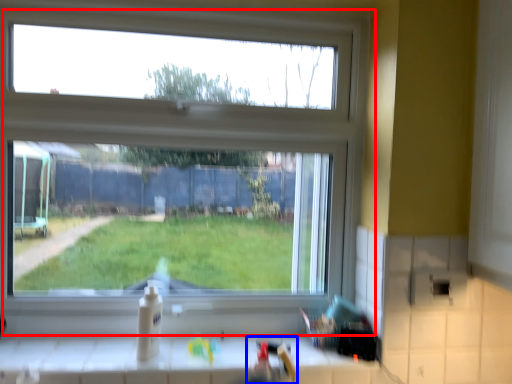
Question: Among these objects, which one is farthest to the camera, window (highlighted by a red box) or sink (highlighted by a blue box)?

Choices:
 (A) window
 (B) sink

Answer: (A)